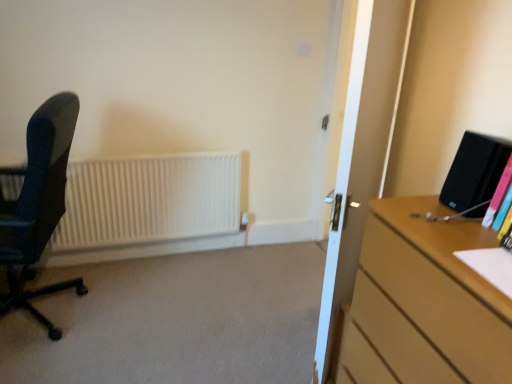
Question: Considering the positions of matte black office chair at left and white matte radiator at left in the image, is matte black office chair at left taller or shorter than white matte radiator at left?

Choices:
 (A) tall
 (B) short

Answer: (A)

Question: Is point (39, 132) closer or farther from the camera than point (116, 180)?

Choices:
 (A) farther
 (B) closer

Answer: (B)

Question: Which object is the closest to the multicolored plastic book at right?

Choices:
 (A) wooden desk at right
 (B) matte black office chair at left
 (C) white matte radiator at left
 (D) transparent glass door at center

Answer: (A)

Question: Considering the real-world distances, which object is closest to the wooden desk at right?

Choices:
 (A) matte black office chair at left
 (B) transparent glass door at center
 (C) multicolored plastic book at right
 (D) white matte radiator at left

Answer: (B)